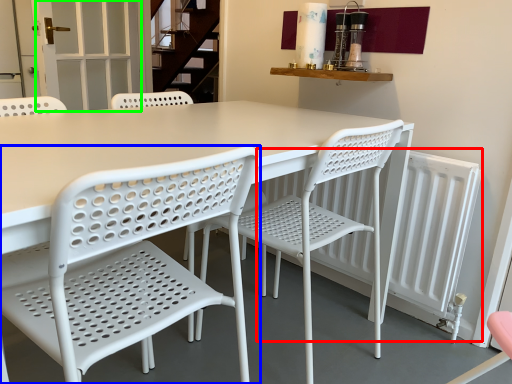
Question: Based on their relative distances, which object is farther from radiator (highlighted by a red box)? Choose from chair (highlighted by a blue box) and screen door (highlighted by a green box).

Choices:
 (A) chair
 (B) screen door

Answer: (B)